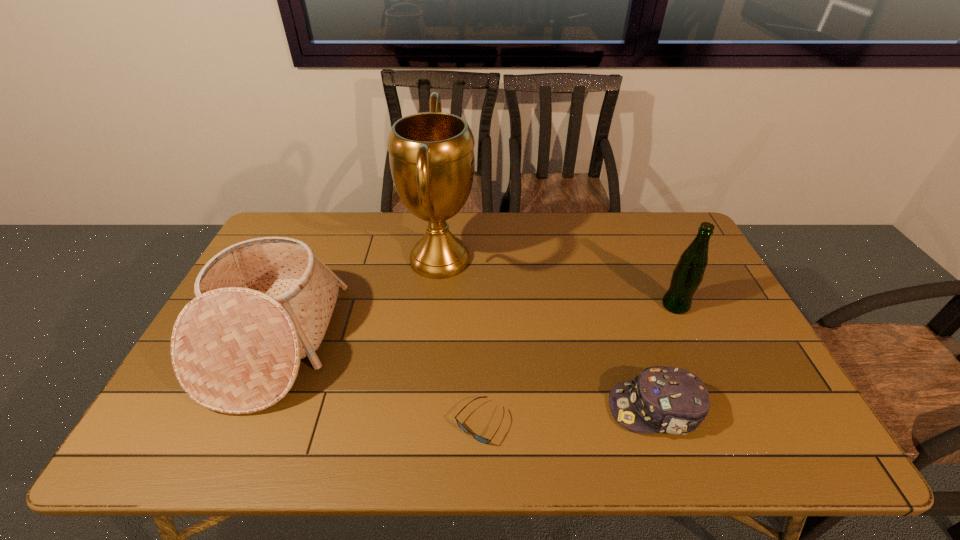
This screenshot has width=960, height=540. Find the location of `free space between the shortest object and the third shortest object`. free space between the shortest object and the third shortest object is located at coordinates (376, 383).

The height and width of the screenshot is (540, 960). Identify the location of unoccupied area between the sunglasses and the rightmost object. tap(578, 364).

You are a GUI agent. You are given a task and a screenshot of the screen. Output one action in this format:
    pyautogui.click(x=<x>, y=<y>)
    Task: Click on the vacant space that's between the second object from right to left and the sunglasses
    
    Given the screenshot: What is the action you would take?
    pyautogui.click(x=567, y=416)

Identify the location of free spot between the tallest object and the headwear. (547, 334).

This screenshot has width=960, height=540. What are the coordinates of `object that is the second nearest to the rightmost object` in the screenshot? It's located at 431,155.

Find the location of a particular element. This screenshot has width=960, height=540. object that stands as the second closest to the tallest object is located at coordinates (481, 439).

Locate an element on the screen. The width and height of the screenshot is (960, 540). free location that satisfies the following two spatial constraints: 1. on the surface of the beer bottle with symbols; 2. on the left side of the tallest object is located at coordinates (435, 306).

You are a GUI agent. You are given a task and a screenshot of the screen. Output one action in this format:
    pyautogui.click(x=<x>, y=<y>)
    Task: Click on the free point that satisfies the following two spatial constraints: 1. on the front side of the beer bottle; 2. with the lid open on the leftmost object
    
    Given the screenshot: What is the action you would take?
    pyautogui.click(x=692, y=342)